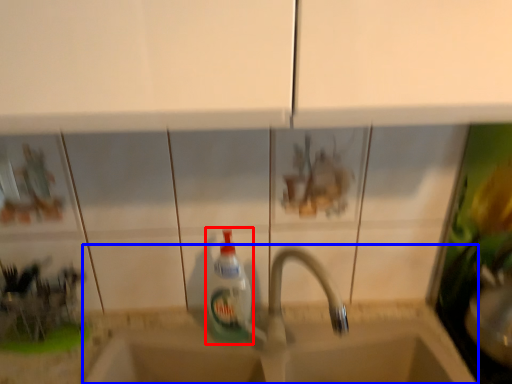
Question: Which point is further to the camera, bottle (highlighted by a red box) or sink (highlighted by a blue box)?

Choices:
 (A) bottle
 (B) sink

Answer: (B)